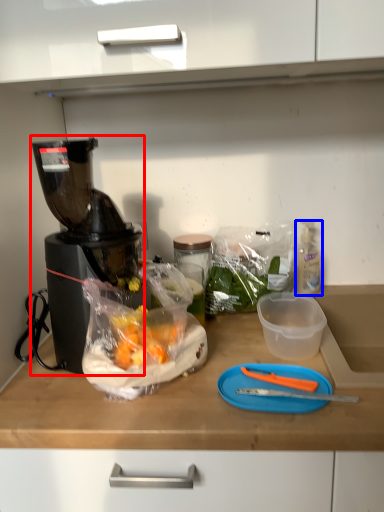
Question: Which object is closer to the camera taking this photo, blender (highlighted by a red box) or bottle (highlighted by a blue box)?

Choices:
 (A) blender
 (B) bottle

Answer: (A)